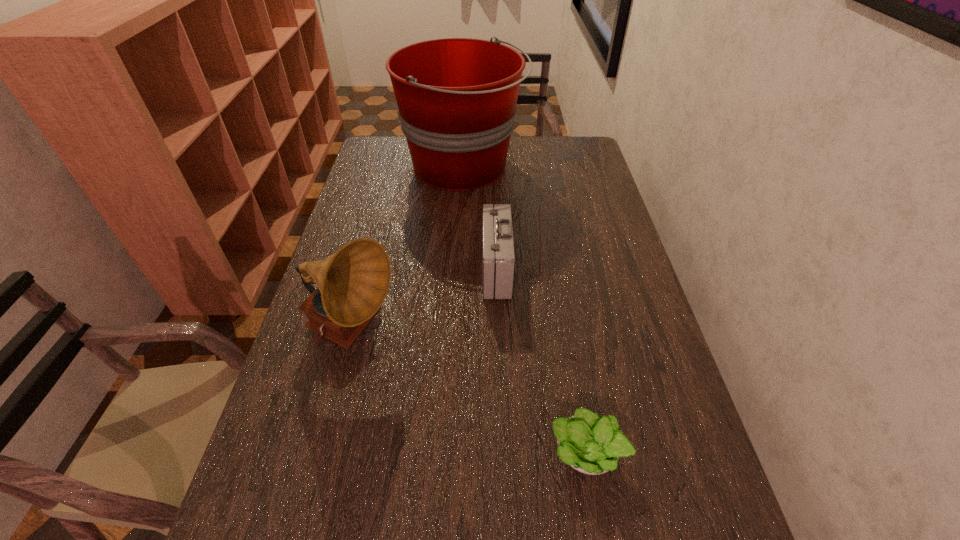
Where is `object that is the third closest one to the nearest object`? object that is the third closest one to the nearest object is located at coordinates (456, 97).

This screenshot has height=540, width=960. Identify the location of object that is the second closest one to the tallest object. (352, 284).

Locate an element on the screen. The width and height of the screenshot is (960, 540). free space that satisfies the following two spatial constraints: 1. on the back side of the nearest object; 2. on the front-facing side of the second shortest object is located at coordinates (556, 269).

The width and height of the screenshot is (960, 540). Find the location of `free point that satisfies the following two spatial constraints: 1. on the horn of the lettuce; 2. on the right side of the phonograph record`. free point that satisfies the following two spatial constraints: 1. on the horn of the lettuce; 2. on the right side of the phonograph record is located at coordinates (323, 453).

This screenshot has width=960, height=540. What are the coordinates of `vacant space that satisfies the following two spatial constraints: 1. on the horn of the phonograph record; 2. on the left side of the nearest object` in the screenshot? It's located at 323,453.

The width and height of the screenshot is (960, 540). In order to click on vacant space that satisfies the following two spatial constraints: 1. on the front side of the tallest object; 2. on the left side of the lettuce in this screenshot , I will do `click(447, 453)`.

Identify the location of vacant space that satisfies the following two spatial constraints: 1. on the horn of the phonograph record; 2. on the right side of the shortest object. Image resolution: width=960 pixels, height=540 pixels. (323, 453).

Locate an element on the screen. This screenshot has width=960, height=540. free location that satisfies the following two spatial constraints: 1. on the back side of the shortest object; 2. on the horn of the phonograph record is located at coordinates (566, 334).

Find the location of `vacant position in the image that satisfies the following two spatial constraints: 1. on the front-facing side of the second shortest object; 2. on the left side of the lettuce`. vacant position in the image that satisfies the following two spatial constraints: 1. on the front-facing side of the second shortest object; 2. on the left side of the lettuce is located at coordinates (503, 453).